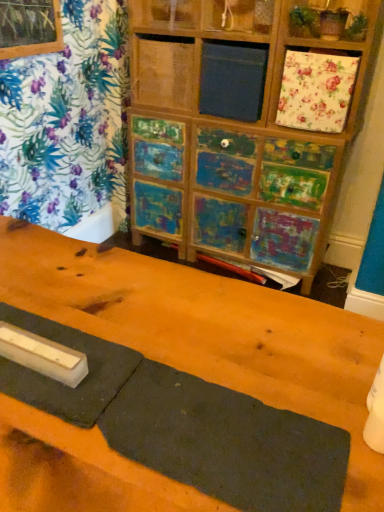
Image resolution: width=384 pixels, height=512 pixels. I want to click on free space above dark gray rubber mat at center (from a real-world perspective), so click(132, 393).